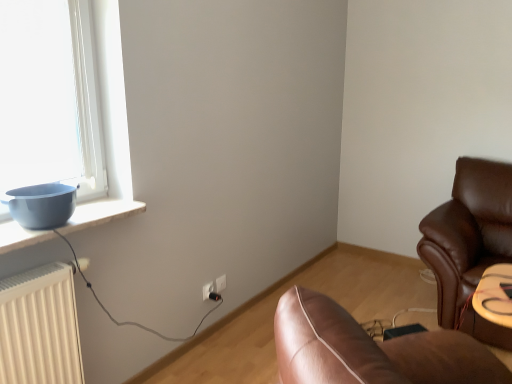
Question: Is point (222, 279) closer or farther from the camera than point (207, 291)?

Choices:
 (A) closer
 (B) farther

Answer: (B)

Question: Looking at the image, does white plastic electric outlet at lower center, the first electric outlet from the right, seem bigger or smaller compared to white plastic electric outlet at center, the 2th electric outlet when ordered from right to left?

Choices:
 (A) small
 (B) big

Answer: (A)

Question: Which object is positioned closest to the white plastic electric outlet at center, the 2th electric outlet when ordered from right to left?

Choices:
 (A) white plastic electric outlet at lower center, placed as the first electric outlet when sorted from back to front
 (B) matte blue bowl at left
 (C) black plastic plug at lower center

Answer: (C)

Question: Which is farther from the black plastic plug at lower center?

Choices:
 (A) white plastic electric outlet at lower center, placed as the first electric outlet when sorted from back to front
 (B) white plastic electric outlet at center, the first electric outlet in the left-to-right sequence
 (C) matte blue bowl at left

Answer: (C)